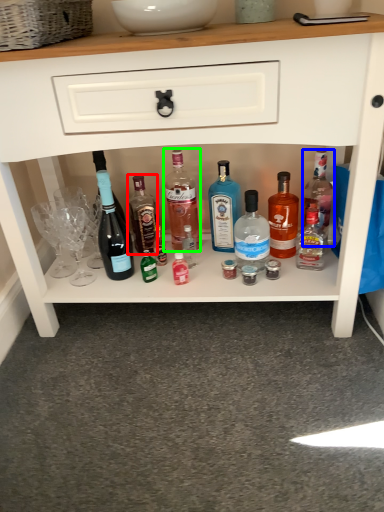
Question: Based on their relative distances, which object is farther from bottle (highlighted by a red box)? Choose from bottle (highlighted by a blue box) and bottle (highlighted by a green box).

Choices:
 (A) bottle
 (B) bottle

Answer: (A)